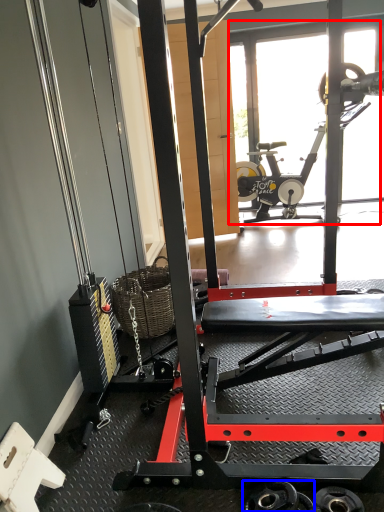
Question: Among these objects, which one is nearest to the camera, glass door (highlighted by a red box) or wheel (highlighted by a blue box)?

Choices:
 (A) glass door
 (B) wheel

Answer: (B)